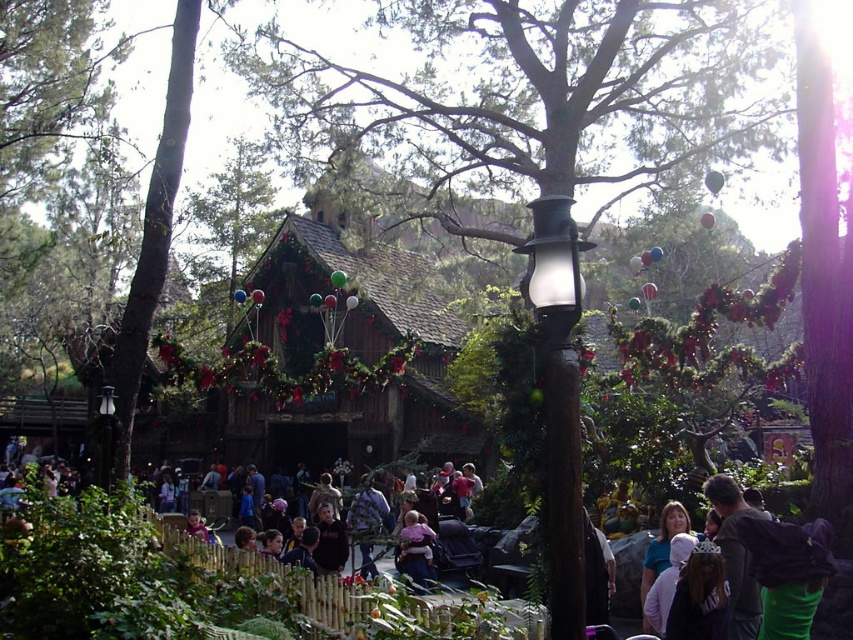
Question: Is the position of dark clothing crowd at center more distant than that of black wood pole at center?

Choices:
 (A) yes
 (B) no

Answer: (A)

Question: Which point is closer to the camera taking this photo?

Choices:
 (A) (102, 451)
 (B) (549, 563)

Answer: (B)

Question: Is dark clothing crowd at center above wooden log cabin at center?

Choices:
 (A) no
 (B) yes

Answer: (A)

Question: Observing the image, what is the correct spatial positioning of dark clothing crowd at center in reference to soft pink fabric baby carrier at center?

Choices:
 (A) below
 (B) above

Answer: (B)

Question: Which point is farther to the camera?

Choices:
 (A) dark clothing crowd at center
 (B) transparent glass lamp post at upper center
 (C) soft pink fabric baby carrier at center
 (D) matte black lamp post at left

Answer: (C)

Question: Which point is farther to the camera?

Choices:
 (A) dark clothing crowd at center
 (B) wooden log cabin at center
 (C) transparent glass lamp post at upper center

Answer: (B)